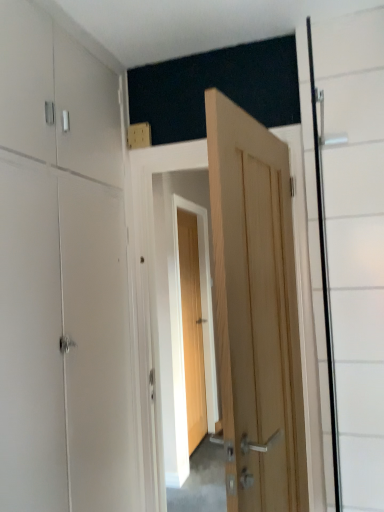
Question: Should I look upward or downward to see wooden door at center, which appears as the 2th door when viewed from the front?

Choices:
 (A) up
 (B) down

Answer: (B)

Question: Is white matte cabinet at left taller than wooden door at center, which appears as the 2th door when viewed from the front?

Choices:
 (A) no
 (B) yes

Answer: (B)

Question: Can you confirm if white matte cabinet at left is positioned to the right of wooden door at center, which is the 1th door in back-to-front order?

Choices:
 (A) no
 (B) yes

Answer: (A)

Question: Can you confirm if white matte cabinet at left is wider than wooden door at center, which appears as the 2th door when viewed from the front?

Choices:
 (A) yes
 (B) no

Answer: (A)

Question: Is there a large distance between white matte cabinet at left and wooden door at center, which is the 1th door in back-to-front order?

Choices:
 (A) yes
 (B) no

Answer: (A)

Question: Is white matte cabinet at left closer to the viewer compared to wooden door at center, which is the 1th door in back-to-front order?

Choices:
 (A) yes
 (B) no

Answer: (A)

Question: From a real-world perspective, is white matte cabinet at left positioned over wooden door at center, which is the 1th door in back-to-front order, based on gravity?

Choices:
 (A) no
 (B) yes

Answer: (B)

Question: Is wooden door at center, which is the 1th door in back-to-front order, bigger than transparent glass door at right?

Choices:
 (A) yes
 (B) no

Answer: (A)

Question: Is wooden door at center, which appears as the 2th door when viewed from the front, placed right next to transparent glass door at right?

Choices:
 (A) yes
 (B) no

Answer: (B)

Question: Could you tell me if wooden door at center, which appears as the 2th door when viewed from the front, is turned towards transparent glass door at right?

Choices:
 (A) no
 (B) yes

Answer: (A)

Question: Is wooden door at center, which appears as the 2th door when viewed from the front, shorter than transparent glass door at right?

Choices:
 (A) no
 (B) yes

Answer: (A)

Question: Does wooden door at center, which appears as the 2th door when viewed from the front, have a greater width compared to transparent glass door at right?

Choices:
 (A) no
 (B) yes

Answer: (B)

Question: Is wooden door at center, which appears as the 2th door when viewed from the front, positioned in front of transparent glass door at right?

Choices:
 (A) no
 (B) yes

Answer: (A)

Question: Is white matte cabinet at left not within natural wood door at center, acting as the second door starting from the back?

Choices:
 (A) yes
 (B) no

Answer: (A)